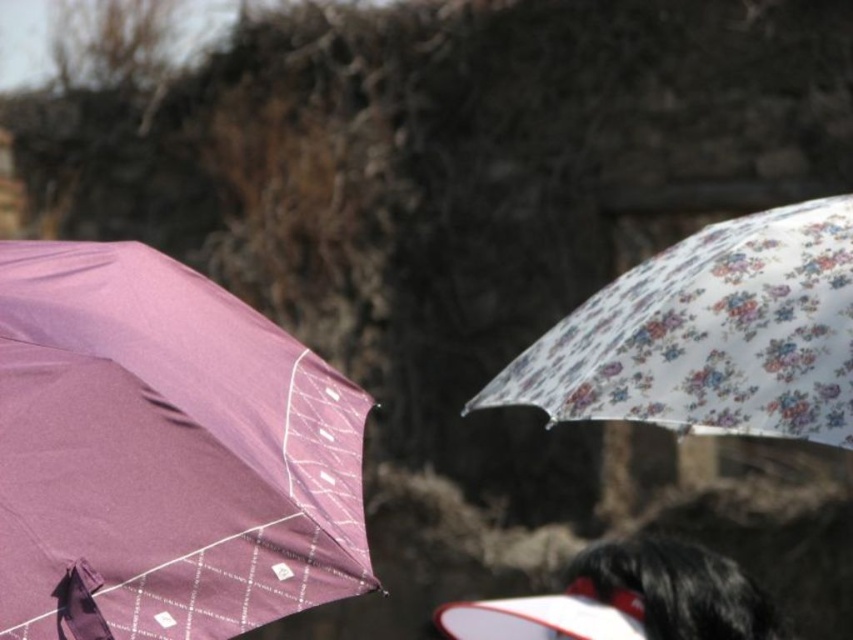
You are standing in a room with two umbrellas. You see the floral printed umbrella at right and the black fuzzy hair at lower right. Which object is higher up?

The floral printed umbrella at right is higher up because it is positioned above the black fuzzy hair at lower right.

You are standing in the scene and see two points marked in the image. Which point is closer to you, point (201, 412) or point (646, 608)?

Point (201, 412) is closer to you because it is in front of point (646, 608).